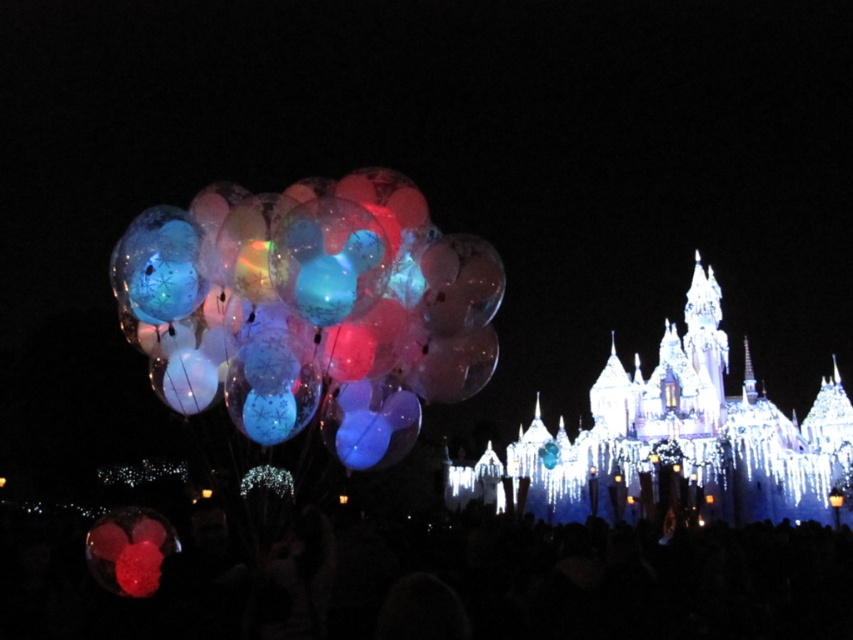
Question: In this image, where is illuminated castle at center located relative to illuminated glass castle at center?

Choices:
 (A) above
 (B) below

Answer: (A)

Question: Which object is positioned farthest from the illuminated castle at center?

Choices:
 (A) illuminated glass castle at center
 (B) translucent plastic balloons at left

Answer: (A)

Question: Does translucent plastic balloons at left have a greater width compared to illuminated glass castle at center?

Choices:
 (A) yes
 (B) no

Answer: (B)

Question: Is illuminated castle at center wider than translucent plastic balloons at left?

Choices:
 (A) yes
 (B) no

Answer: (A)

Question: Which point is farther to the camera?

Choices:
 (A) translucent plastic balloons at left
 (B) illuminated glass castle at center

Answer: (B)

Question: Which point is closer to the camera?

Choices:
 (A) (235, 404)
 (B) (254, 289)
 (C) (787, 461)

Answer: (B)